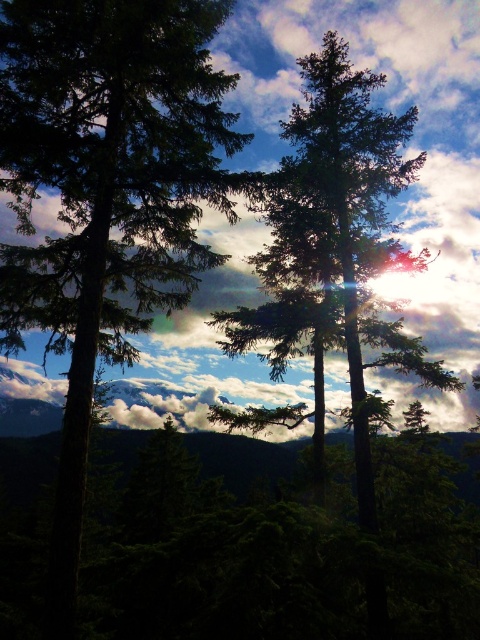
Question: Considering the real-world distances, which object is closest to the white fluffy cloud at upper center?

Choices:
 (A) green matte trees at center
 (B) green matte tree at center
 (C) dark green textured tree at left

Answer: (B)

Question: Is white fluffy cloud at upper center positioned at the back of green matte tree at center?

Choices:
 (A) no
 (B) yes

Answer: (B)

Question: Which object appears farthest from the camera in this image?

Choices:
 (A) white fluffy cloud at upper center
 (B) green matte tree at center
 (C) dark green textured tree at left

Answer: (A)

Question: Is white fluffy cloud at upper center further to the viewer compared to green matte tree at center?

Choices:
 (A) yes
 (B) no

Answer: (A)

Question: Does dark green textured tree at left have a lesser width compared to green matte trees at center?

Choices:
 (A) no
 (B) yes

Answer: (B)

Question: Which point is farther from the camera taking this photo?

Choices:
 (A) (192, 284)
 (B) (396, 536)
 (C) (240, 289)
 (D) (423, 372)

Answer: (C)